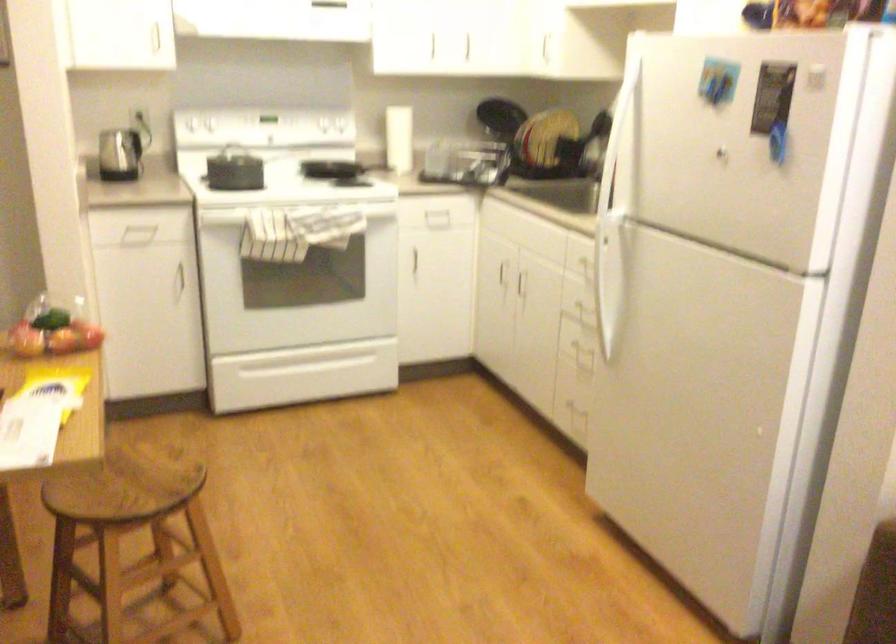
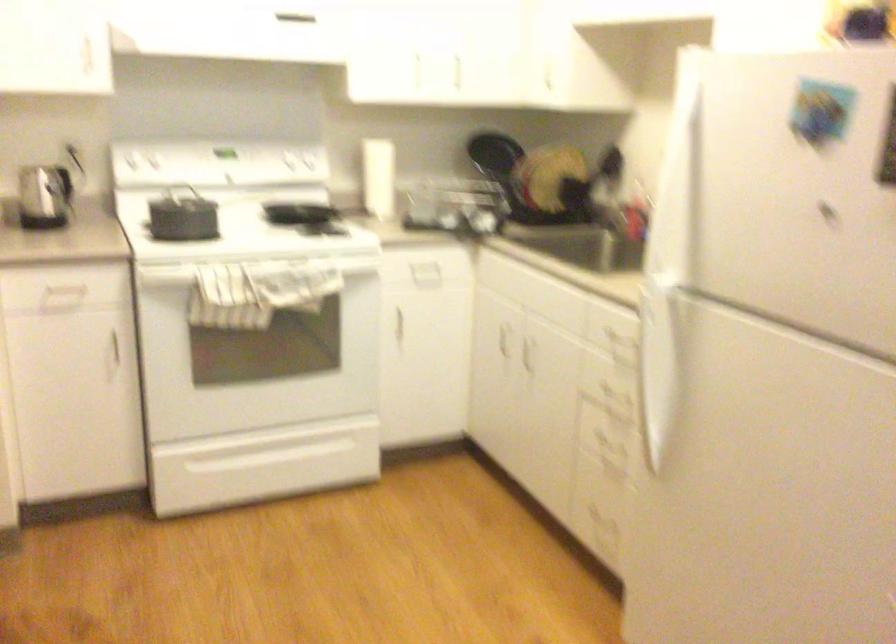
Where in the second image is the point corresponding to [315,124] from the first image?

(283, 169)